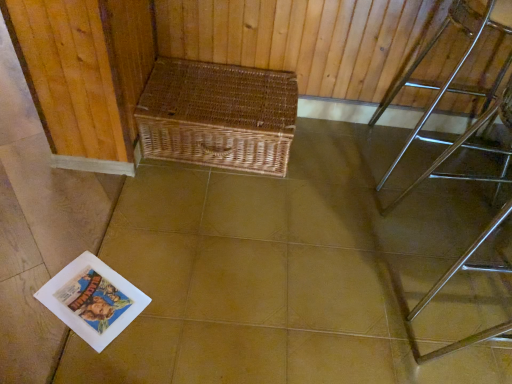
Where is `unoccupied region to the right of woven brown picnic basket at center`? unoccupied region to the right of woven brown picnic basket at center is located at coordinates (336, 177).